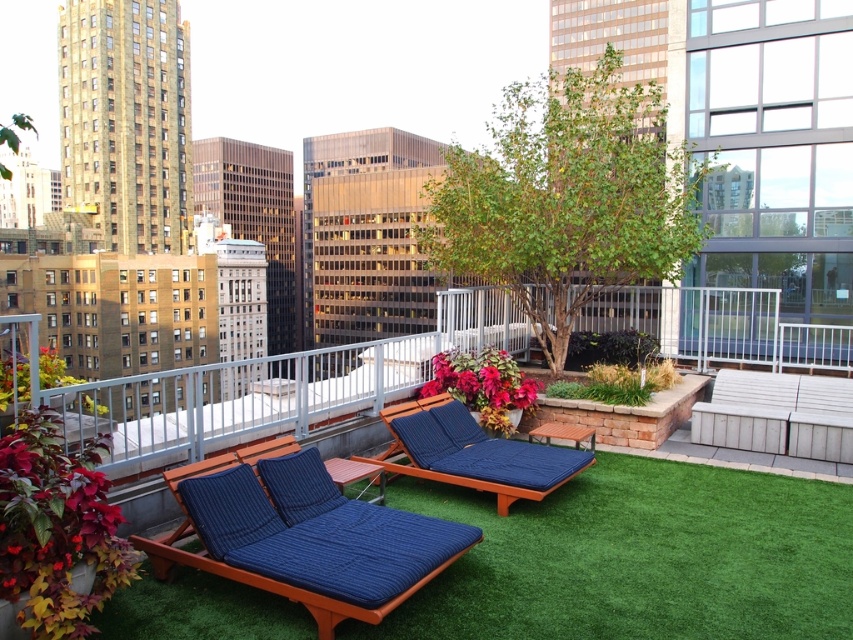
Question: Which object appears closest to the camera in this image?

Choices:
 (A) white wood bench at lower right
 (B) matte blue cushioned lounge chair at center
 (C) vibrant red petals at center

Answer: (B)

Question: Is green artificial turf at center bigger than vibrant red petals at center?

Choices:
 (A) yes
 (B) no

Answer: (B)

Question: Can you confirm if green artificial turf at center is positioned below white wood bench at lower right?

Choices:
 (A) no
 (B) yes

Answer: (B)

Question: Among these objects, which one is farthest from the camera?

Choices:
 (A) green artificial turf at center
 (B) vibrant red petals at center

Answer: (B)

Question: Does matte blue cushioned lounge chair at center have a lesser width compared to white wood bench at lower right?

Choices:
 (A) no
 (B) yes

Answer: (A)

Question: Which of the following is the closest to the observer?

Choices:
 (A) (289, 584)
 (B) (485, 406)
 (C) (392, 445)

Answer: (A)